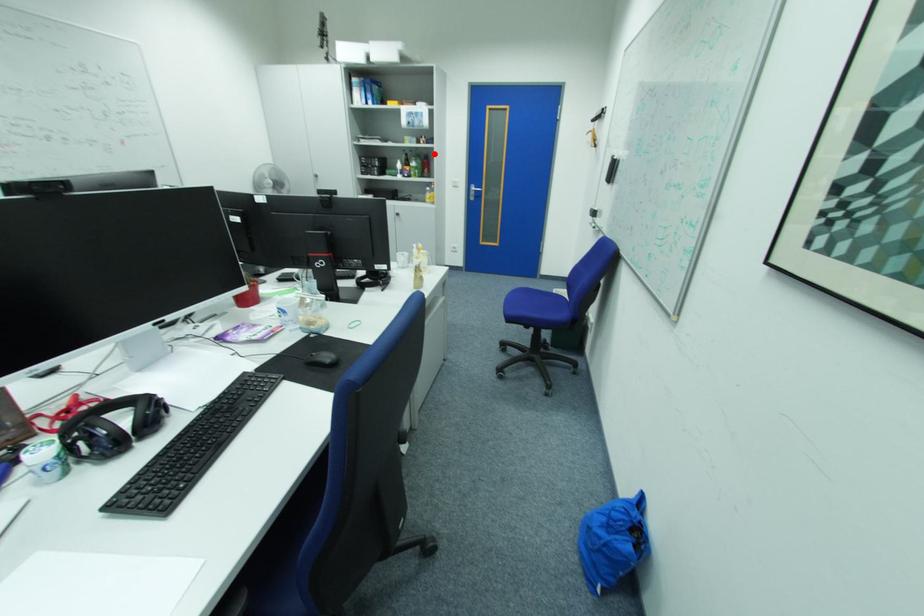
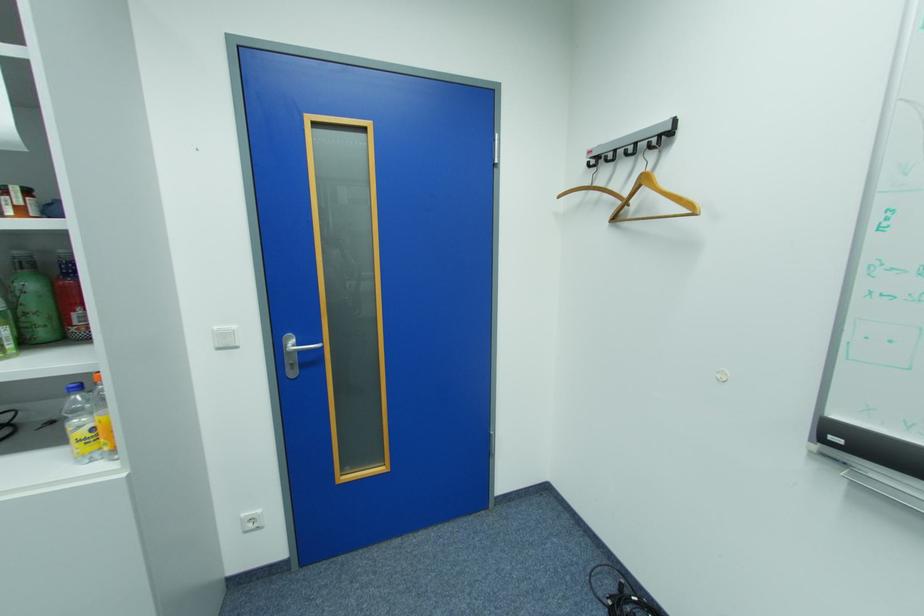
In the second image, find the point that corresponds to the highlighted location in the first image.

(69, 252)